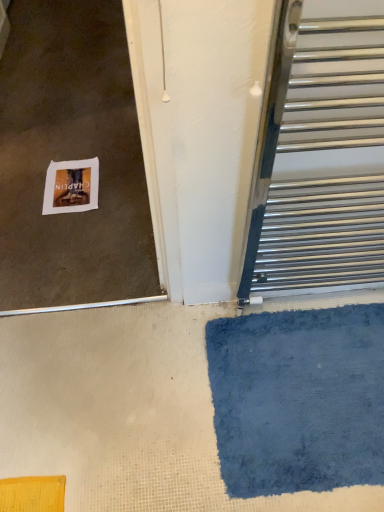
You are a GUI agent. You are given a task and a screenshot of the screen. Output one action in this format:
    pyautogui.click(x=<x>, y=<y>)
    Task: Click on the vacant space in front of white paper at lower left
    This screenshot has width=384, height=512.
    Given the screenshot: What is the action you would take?
    pyautogui.click(x=57, y=244)